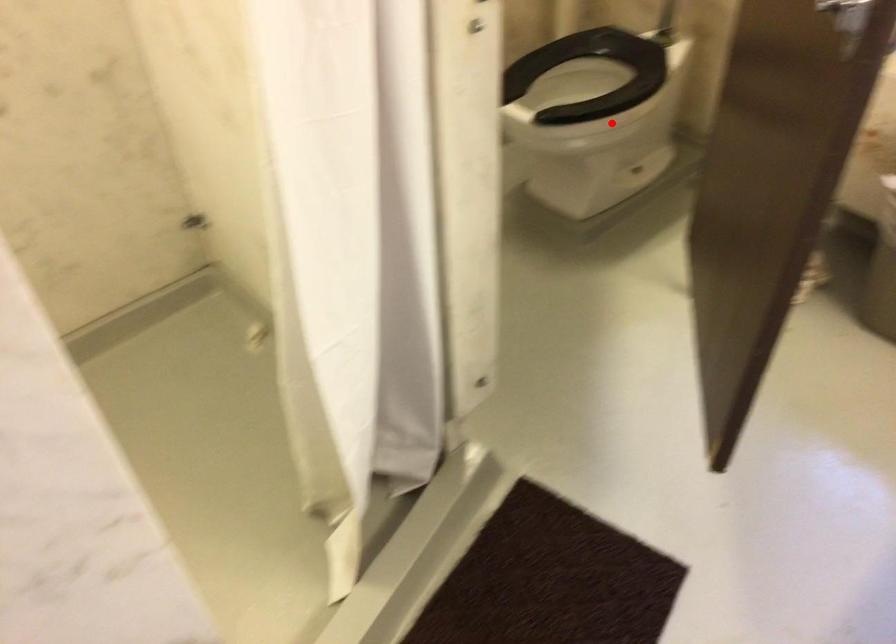
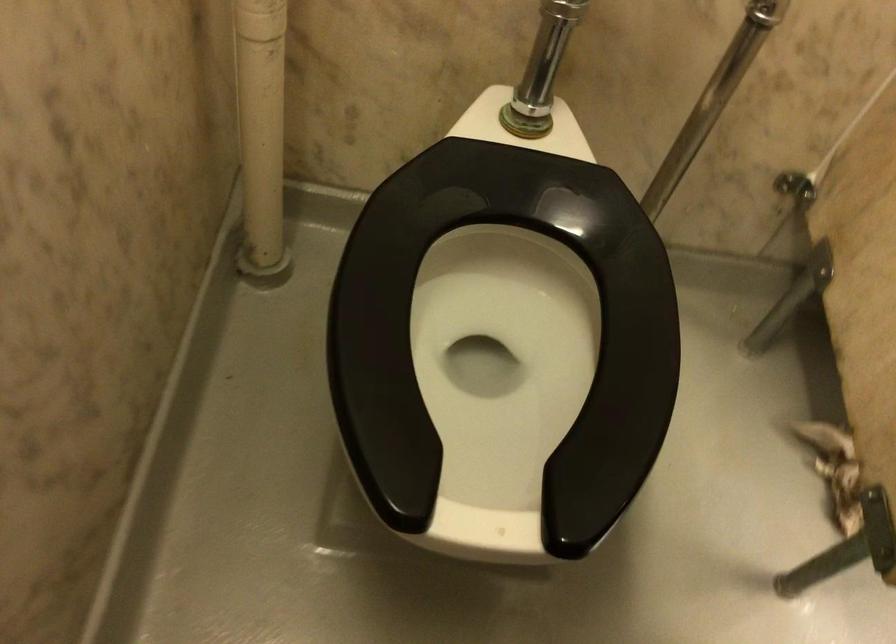
Question: I am providing you with two images of the same scene from different viewpoints. Given a red point in image1, look at the same physical point in image2. Is it:

Choices:
 (A) Closer to the viewpoint
 (B) Farther from the viewpoint

Answer: (A)